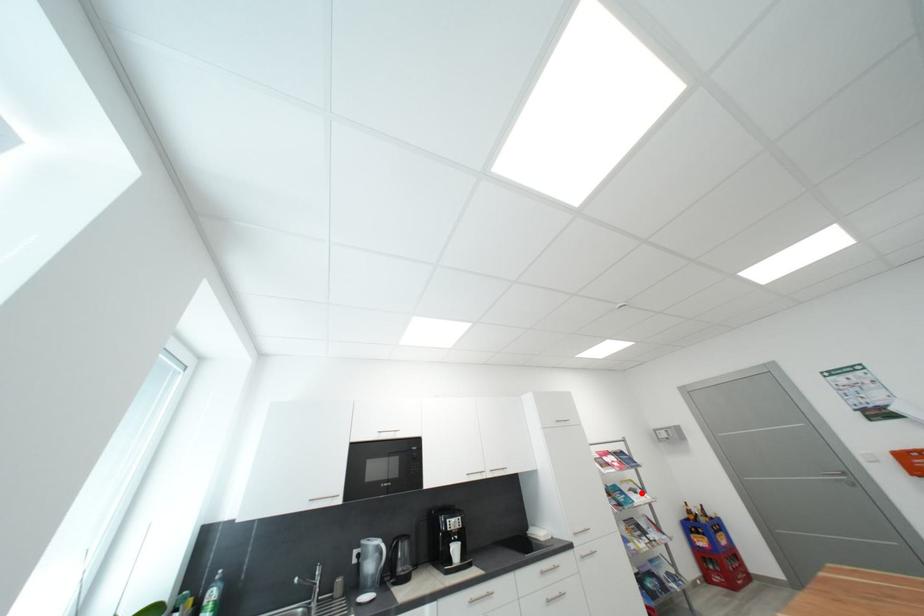
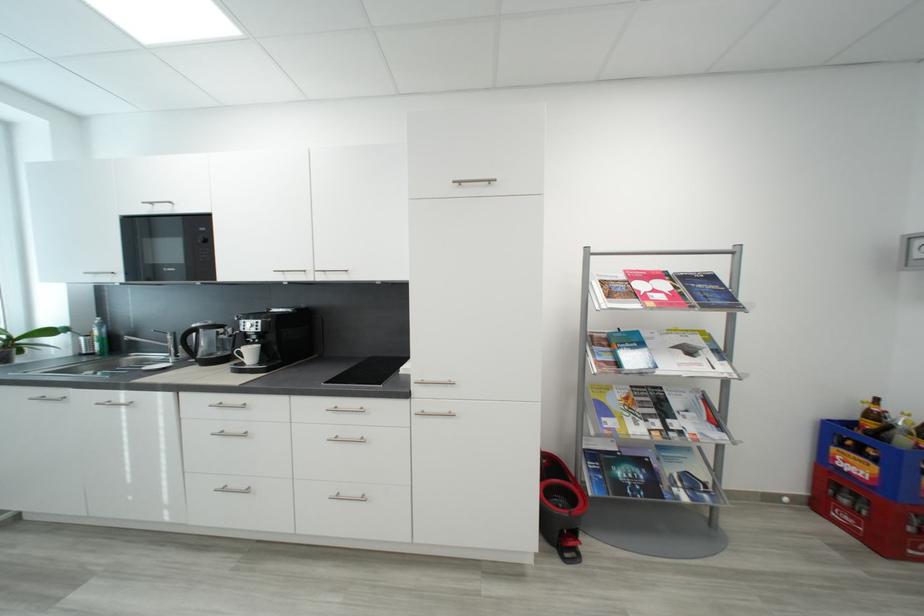
Question: I am providing you with two images of the same scene from different viewpoints. A red point is shown in image1. For the corresponding object point in image2, is it positioned nearer or farther from the camera?

Choices:
 (A) Nearer
 (B) Farther

Answer: (A)